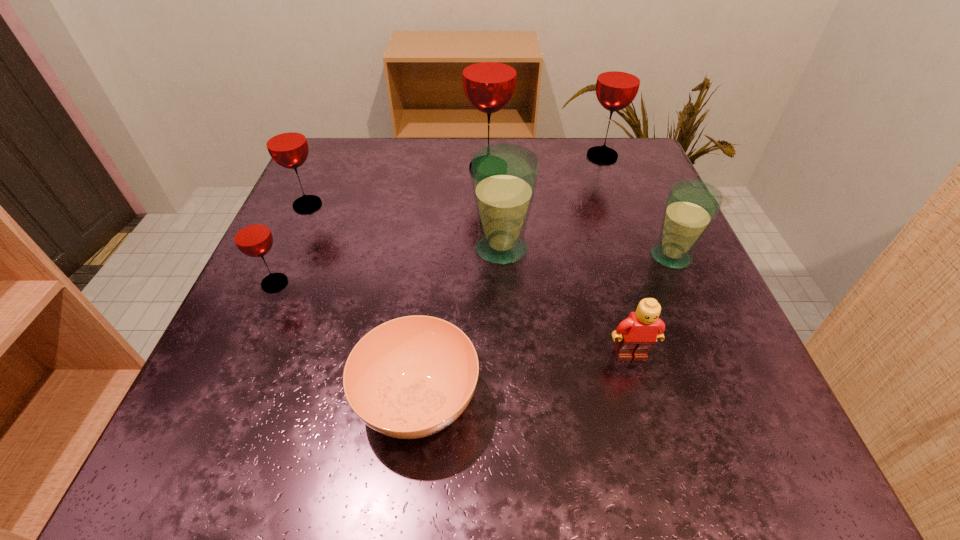
The height and width of the screenshot is (540, 960). In order to click on vacant position in the image that satisfies the following two spatial constraints: 1. on the back side of the shortest object; 2. on the left side of the tallest glass in this screenshot , I will do `click(443, 168)`.

Find the location of `free point that satisfies the following two spatial constraints: 1. on the front side of the shortest object; 2. on the right side of the nearest red glass`. free point that satisfies the following two spatial constraints: 1. on the front side of the shortest object; 2. on the right side of the nearest red glass is located at coordinates click(x=223, y=401).